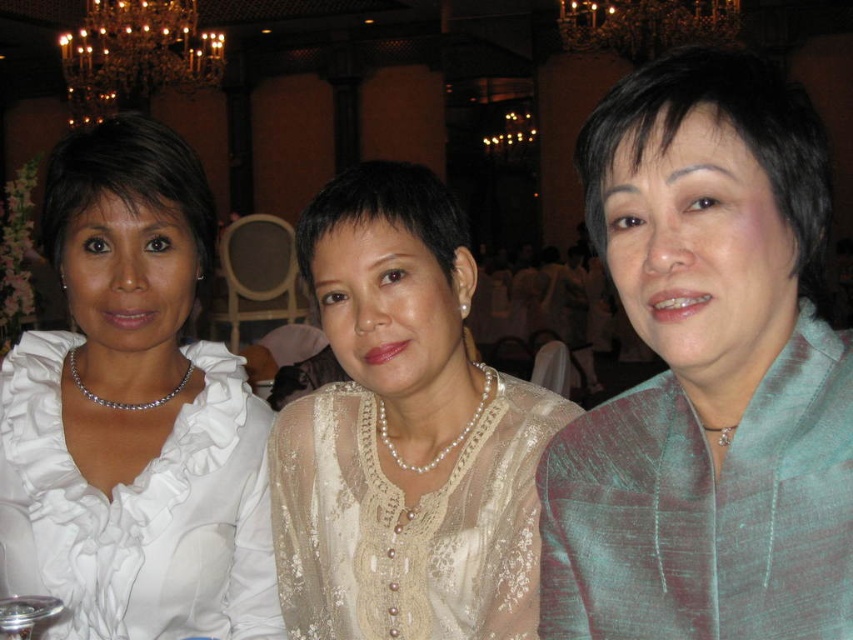
You are a photographer at a formal event. You need to capture a photo of the teal silk jacket at center and pearl lace blouse at center. Which one of these items has a smaller width?

The teal silk jacket at center has a lesser width compared to the pearl lace blouse at center, so the teal silk jacket at center is smaller in width.

You are standing at the center of the banquet hall and see two points in the image. The first point is at coordinates point (113, 492) and the second point is at coordinates point (403, 486). Which point is closer to you?

Point (403, 486) is closer to you because point (113, 492) is behind it.

You are a photographer at a formal event. You need to capture a shot of the teal silk jacket at center and the white satin blouse at left. Based on their positions, which one is positioned to the right of the other?

The teal silk jacket at center is positioned to the right of the white satin blouse at left.